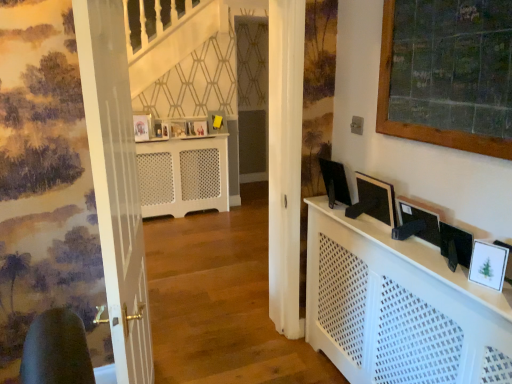
At what (x,y) coordinates should I click in order to perform the action: click on vacant space that is to the left of white glossy picture frame at lower right, which is counted as the fifth picture frame, starting from the left. Please return your answer as a coordinate pair (x, y). Looking at the image, I should click on pos(457,276).